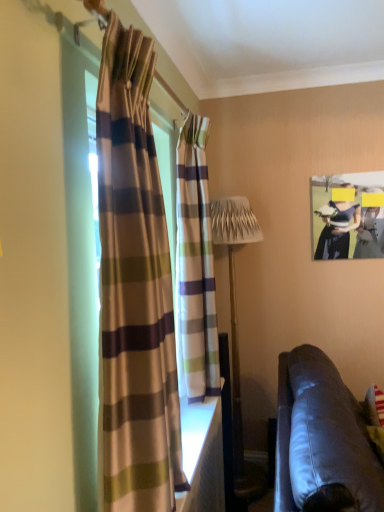
Question: Should I look upward or downward to see leather couch at lower right?

Choices:
 (A) up
 (B) down

Answer: (B)

Question: Considering the relative sizes of leather couch at lower right and striped fabric curtain at left, which is the 2th curtain in back-to-front order, in the image provided, is leather couch at lower right thinner than striped fabric curtain at left, which is the 2th curtain in back-to-front order,?

Choices:
 (A) no
 (B) yes

Answer: (A)

Question: Does leather couch at lower right have a greater height compared to striped fabric curtain at left, which is the 2th curtain in back-to-front order?

Choices:
 (A) no
 (B) yes

Answer: (A)

Question: Does leather couch at lower right come behind striped fabric curtain at left, which is the 2th curtain in back-to-front order?

Choices:
 (A) yes
 (B) no

Answer: (B)

Question: Can we say leather couch at lower right lies outside striped fabric curtain at left, which is the 2th curtain in back-to-front order?

Choices:
 (A) no
 (B) yes

Answer: (B)

Question: Is striped fabric curtain at left, which appears as the first curtain when viewed from the front, at the back of leather couch at lower right?

Choices:
 (A) no
 (B) yes

Answer: (A)

Question: From a real-world perspective, does leather couch at lower right sit lower than striped fabric curtain at left, which appears as the first curtain when viewed from the front?

Choices:
 (A) yes
 (B) no

Answer: (A)

Question: Does matte black hat at upper right have a lesser height compared to striped fabric curtain at left, which is the 2th curtain in back-to-front order?

Choices:
 (A) no
 (B) yes

Answer: (B)

Question: Does matte black hat at upper right appear on the right side of striped fabric curtain at left, which appears as the first curtain when viewed from the front?

Choices:
 (A) yes
 (B) no

Answer: (A)

Question: Is matte black hat at upper right aimed at striped fabric curtain at left, which appears as the first curtain when viewed from the front?

Choices:
 (A) yes
 (B) no

Answer: (A)

Question: Is striped fabric curtain at left, which appears as the first curtain when viewed from the front, inside matte black hat at upper right?

Choices:
 (A) no
 (B) yes

Answer: (A)

Question: Is matte black hat at upper right beside striped fabric curtain at left, which appears as the first curtain when viewed from the front?

Choices:
 (A) no
 (B) yes

Answer: (A)

Question: Does matte black hat at upper right come in front of striped fabric curtain at left, which is the 2th curtain in back-to-front order?

Choices:
 (A) no
 (B) yes

Answer: (A)

Question: Can you confirm if striped fabric curtain at left, which appears as the first curtain when viewed from the front, is positioned to the right of matte black hat at upper right?

Choices:
 (A) no
 (B) yes

Answer: (A)